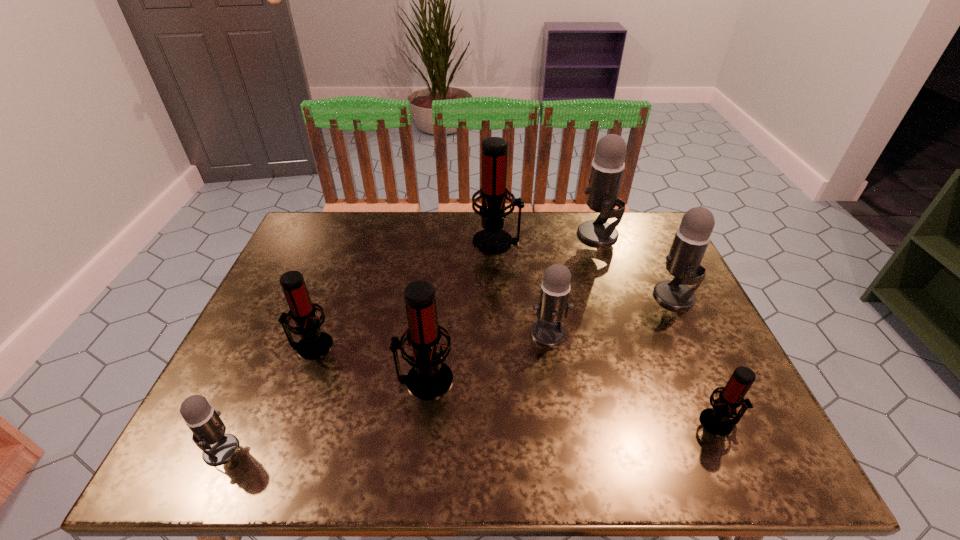
The image size is (960, 540). I want to click on vacant region at the far left corner of the desktop, so click(311, 229).

This screenshot has width=960, height=540. Find the location of `vacant space that is in between the third nearest gray microphone and the farthest red microphone`. vacant space that is in between the third nearest gray microphone and the farthest red microphone is located at coordinates (586, 268).

In order to click on vacant area that lies between the sixth object from left to right and the sixth nearest microphone in this screenshot , I will do `click(636, 265)`.

Where is `unoccupied position between the third nearest red microphone and the sixth nearest microphone`? The image size is (960, 540). unoccupied position between the third nearest red microphone and the sixth nearest microphone is located at coordinates (492, 321).

I want to click on blank region between the second gray microphone from left to right and the leftmost gray microphone, so click(385, 391).

This screenshot has width=960, height=540. What are the coordinates of `free space between the rightmost red microphone and the smallest gray microphone` in the screenshot? It's located at (470, 436).

Where is `vacant area that lies between the second nearest gray microphone and the sixth object from right to left`? vacant area that lies between the second nearest gray microphone and the sixth object from right to left is located at coordinates (487, 356).

Where is `empty location between the sixth microphone from right to left and the biggest red microphone`? This screenshot has width=960, height=540. empty location between the sixth microphone from right to left and the biggest red microphone is located at coordinates (461, 310).

You are a GUI agent. You are given a task and a screenshot of the screen. Output one action in this format:
    pyautogui.click(x=<x>, y=<y>)
    Task: Click on the free space that is in between the nearest gray microphone and the nearest red microphone
    
    Given the screenshot: What is the action you would take?
    pyautogui.click(x=470, y=436)

Point out which object is positioned as the fifth nearest to the second gray microphone from right to left. Please provide its 2D coordinates. Your answer should be formatted as a tuple, i.e. [(x, y)], where the tuple contains the x and y coordinates of a point satisfying the conditions above.

[(429, 378)]